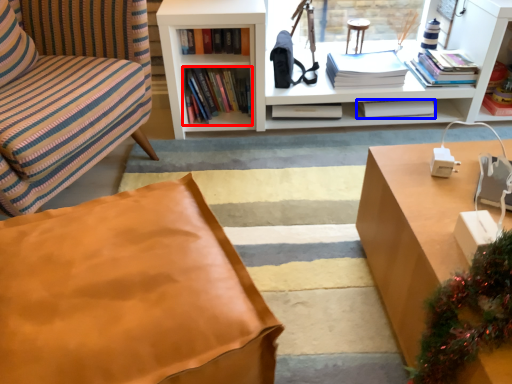
Question: Among these objects, which one is farthest to the camera, book (highlighted by a red box) or book (highlighted by a blue box)?

Choices:
 (A) book
 (B) book

Answer: (B)